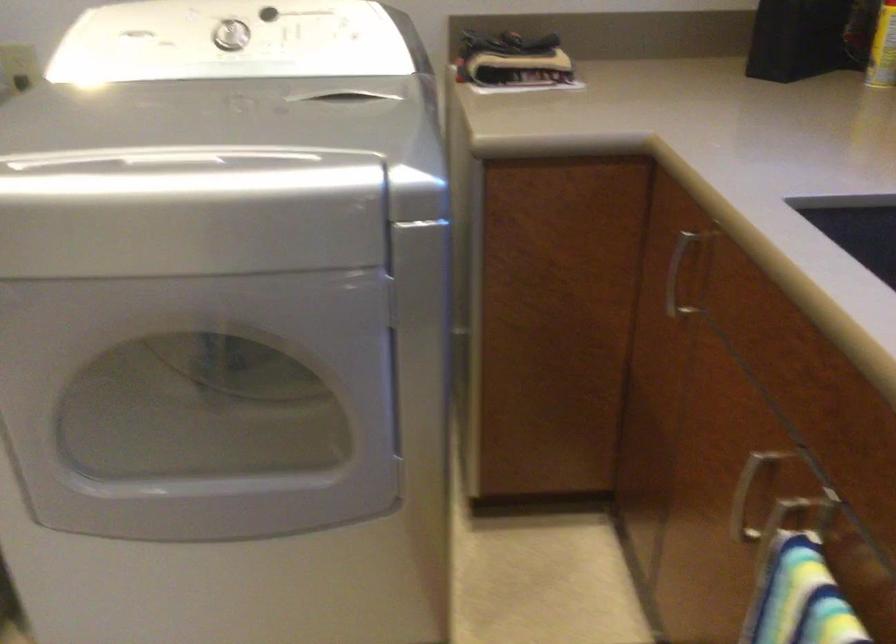
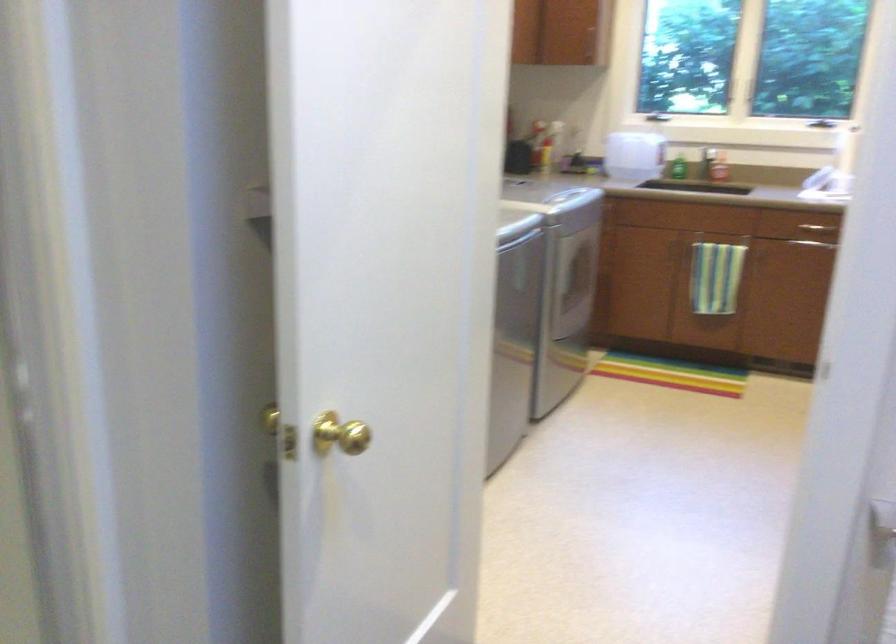
Question: I am providing you with two images of the same scene from different viewpoints. Which of the following objects are not visible in image2?

Choices:
 (A) black window latch
 (B) gold door knob
 (C) hanging chair sitting surface
 (D) white control dial

Answer: (D)